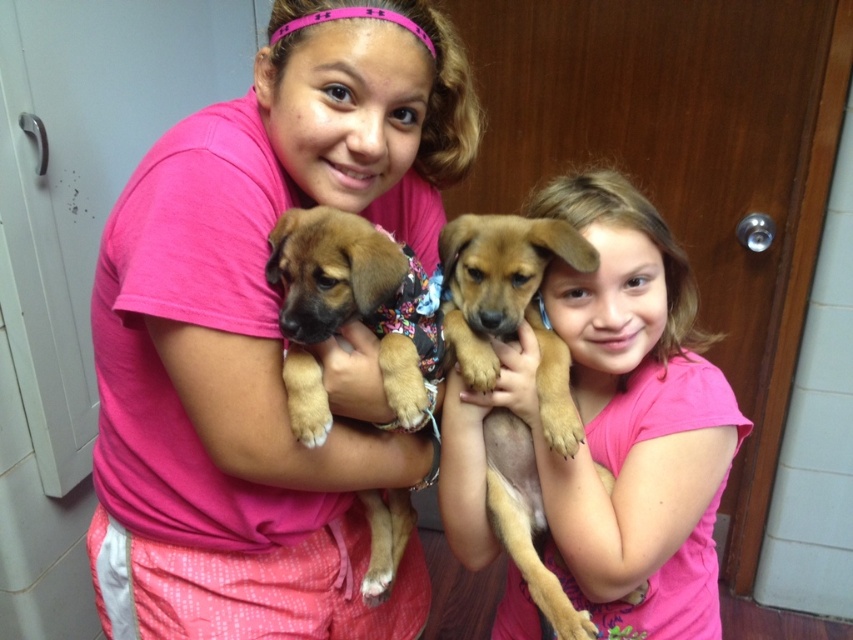
Consider the image. You are a photographer trying to capture a photo of the brown furry dog at center. You notice there is a pink fabric shirt at center in the way. Based on their positions, which object is closer to the camera?

The pink fabric shirt at center is positioned on the left side of brown furry dog at center, so the pink fabric shirt at center is closer to the camera.

You are a photographer taking a picture of the scene. You notice the pink fabric shirt at center and the brown soft fur puppy at center. Which object is closer to the camera?

The pink fabric shirt at center is closer to the camera because it is in front of the brown soft fur puppy at center.

You are a photographer trying to capture a photo of both the brown furry dog at center and the brown soft fur puppy at center. Since you want to ensure both are fully visible in the frame, which one should you focus on first to account for their size difference?

The brown furry dog at center is much taller than the brown soft fur puppy at center, so you should focus on the brown furry dog at center first to ensure its full height is captured before adjusting the frame for the smaller puppy.